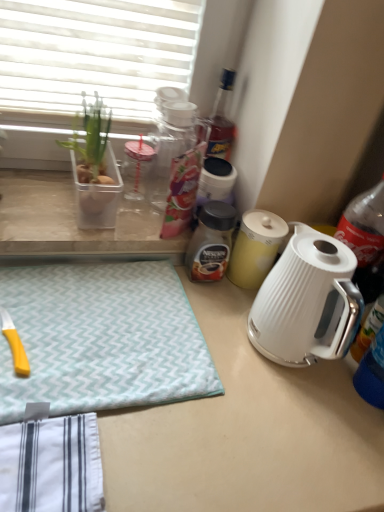
Identify the location of free region under teal zigzag fabric at lower left (from a real-world perspective). (108, 326).